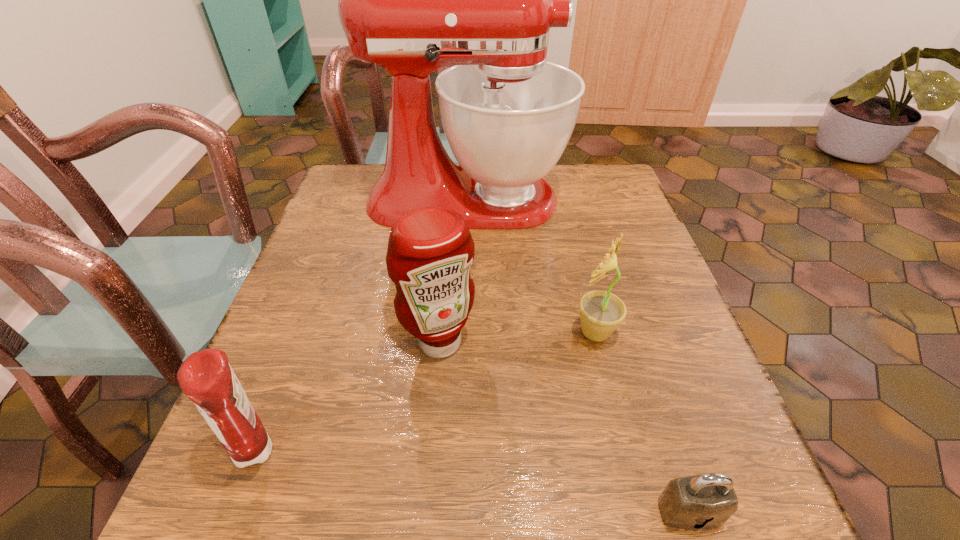
At what (x,y) coordinates should I click in order to perform the action: click on vacant space located 0.160m on the back of the fourth shortest object. Please return your answer as a coordinate pair (x, y). The image size is (960, 540). Looking at the image, I should click on (446, 265).

This screenshot has height=540, width=960. I want to click on vacant space located 0.170m on the face of the sunflower, so click(x=479, y=333).

Image resolution: width=960 pixels, height=540 pixels. Identify the location of vacant area situated on the face of the sunflower. (441, 333).

The image size is (960, 540). Identify the location of blank space located 0.270m on the face of the sunflower. tap(424, 333).

What are the coordinates of `free space located on the back of the shorter condiment` in the screenshot? It's located at (304, 325).

The width and height of the screenshot is (960, 540). What are the coordinates of `object present at the far edge` in the screenshot? It's located at (412, 0).

Where is `condiment situated at the near edge`? This screenshot has width=960, height=540. condiment situated at the near edge is located at coordinates (206, 378).

The width and height of the screenshot is (960, 540). What are the coordinates of `padlock at the near edge` in the screenshot? It's located at (705, 501).

In order to click on mixer that is at the left edge in this screenshot , I will do `click(412, 0)`.

Locate an element on the screen. Image resolution: width=960 pixels, height=540 pixels. condiment that is at the left edge is located at coordinates (206, 378).